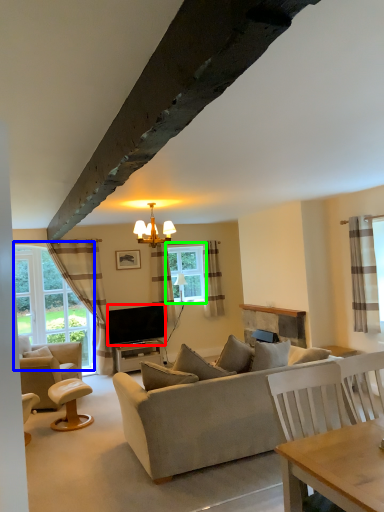
Question: Which object is positioned farthest from television (highlighted by a red box)? Select from bay window (highlighted by a blue box) and window (highlighted by a green box).

Choices:
 (A) bay window
 (B) window

Answer: (A)